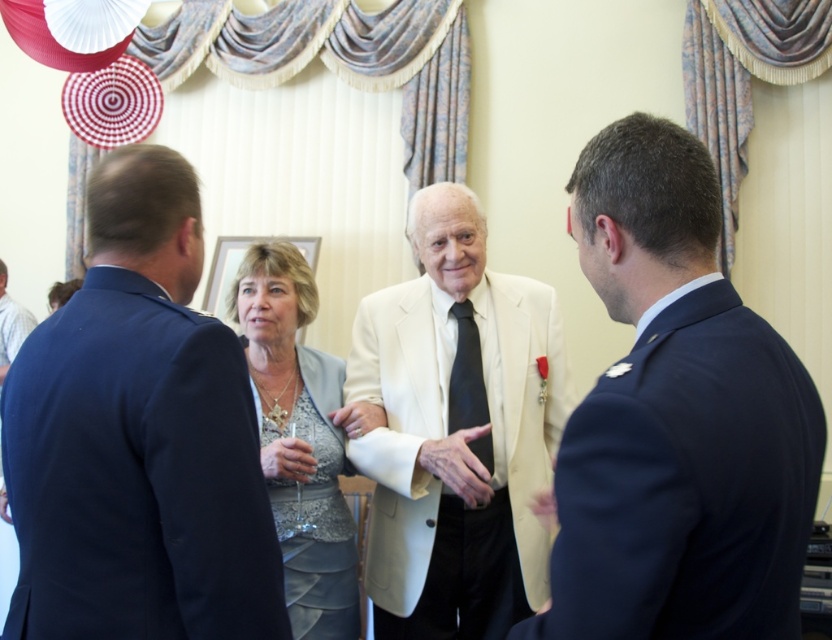
You are planning to place a decorative ribbon on the gray satin dress at center and the black silk tie at center. Which item requires a longer ribbon to fully encircle it?

The gray satin dress at center requires a longer ribbon to fully encircle it since it might be wider than the black silk tie at center.

You are a photographer at the event and need to ensure that both the light beige suit at center and the black silk tie at center are visible in the photo. Considering their positions, which object is more likely to be fully visible in the frame?

The light beige suit at center is wider than the black silk tie at center, so the light beige suit at center is more likely to be fully visible in the frame.

You are standing at point (466,356) and want to move to the entrance of the room, which is located behind point (479,253). Can you walk directly to the entrance without moving around any obstacles?

Point (479,253) is in front of point (466,356), so you are behind the entrance. To reach the entrance, you must move forward towards point (479,253).